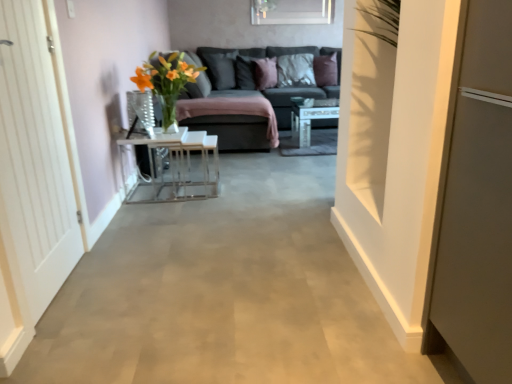
Question: Considering the relative positions of white wooden door at left and velvet dark gray pillow at upper center, which appears as the 2th pillow when viewed from the left, in the image provided, is white wooden door at left to the left or to the right of velvet dark gray pillow at upper center, which appears as the 2th pillow when viewed from the left,?

Choices:
 (A) right
 (B) left

Answer: (B)

Question: From the image's perspective, is white wooden door at left above or below velvet dark gray pillow at upper center, which appears as the 2th pillow when viewed from the left?

Choices:
 (A) below
 (B) above

Answer: (A)

Question: Which is nearer to the velvet dark gray pillow at center, the second pillow viewed from the right?

Choices:
 (A) clear glass vase at center
 (B) purple velvet pillow at upper center, marked as the 5th pillow in a left-to-right arrangement
 (C) velvet dark gray pillow at upper center, which appears as the 2th pillow when viewed from the left
 (D) metallic white table at center
 (E) white wooden door at left

Answer: (B)

Question: Which is nearer to the velvet dark gray pillow at center, the second pillow viewed from the right?

Choices:
 (A) clear glass vase at center
 (B) purple velvet pillow at center, the third pillow viewed from the right
 (C) metallic white table at center
 (D) purple velvet pillow at upper center, which is counted as the first pillow, starting from the right
 (E) suede-like gray pillow at center, placed as the 1th pillow when sorted from left to right

Answer: (D)